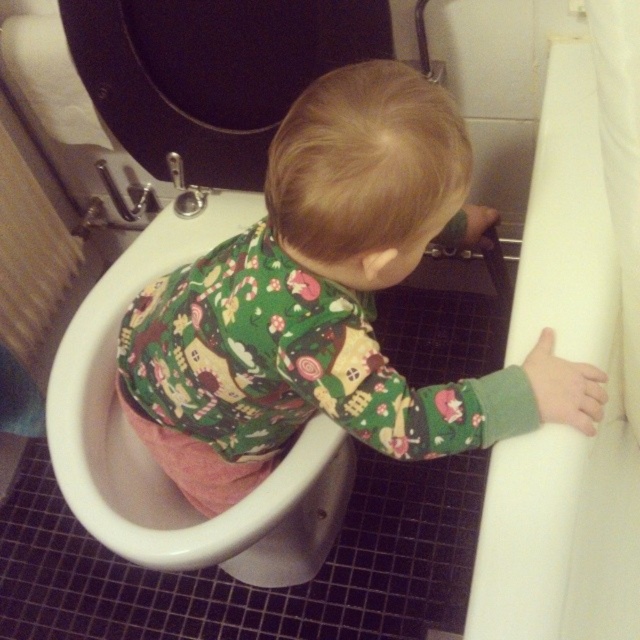
You are a parent trying to ensure your child is safely seated on the toilet. Given the height of the green cotton pajamas at center compared to the black glossy toilet lid at upper center, do you think the child might need a step stool to reach the toilet properly?

The green cotton pajamas at center is much taller than the black glossy toilet lid at upper center, so the child might not need a step stool since they are already taller than the toilet lid.

You are a parent trying to decide whether to place a new toy on the green cotton pajamas at center or the white smooth bathtub at right. Which surface can accommodate a taller toy without it falling over?

The white smooth bathtub at right is taller than the green cotton pajamas at center, so placing the taller toy on the white smooth bathtub at right would be more stable and prevent it from tipping over.

You are a plumber inspecting a bathroom. You see the white glossy toilet bowl at center and the black glossy toilet lid at upper center. Which object is located below the other?

The white glossy toilet bowl at center is positioned under the black glossy toilet lid at upper center.